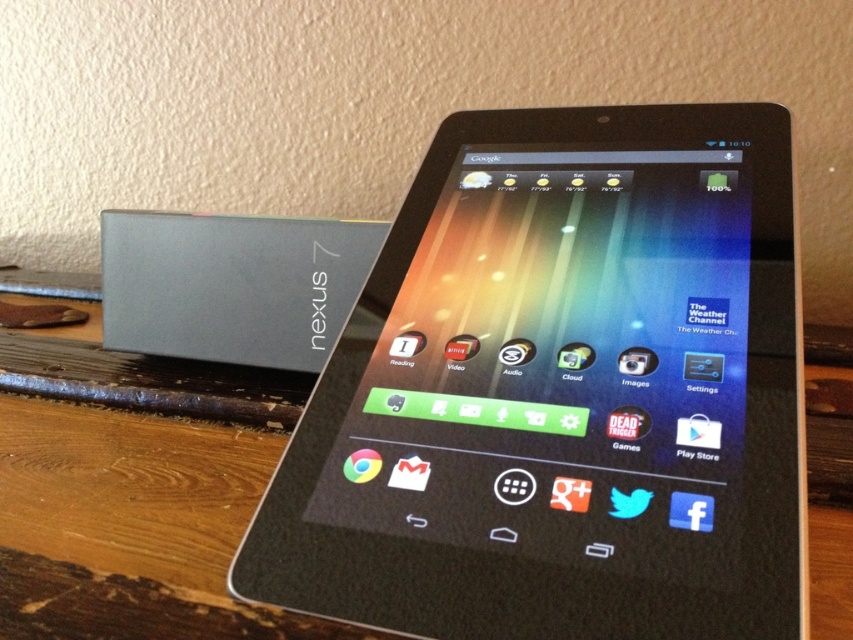
You are trying to locate the black glossy tablet at center on a wooden surface. According to the coordinates provided, where exactly is the tablet positioned?

The black glossy tablet at center is located at point (561, 392).

You are trying to reach the black glossy tablet at center from the slate gray plastic nexus 7 at left. Which direction should you move towards?

The black glossy tablet at center is in front of the slate gray plastic nexus 7 at left, so you should move forward to reach it.